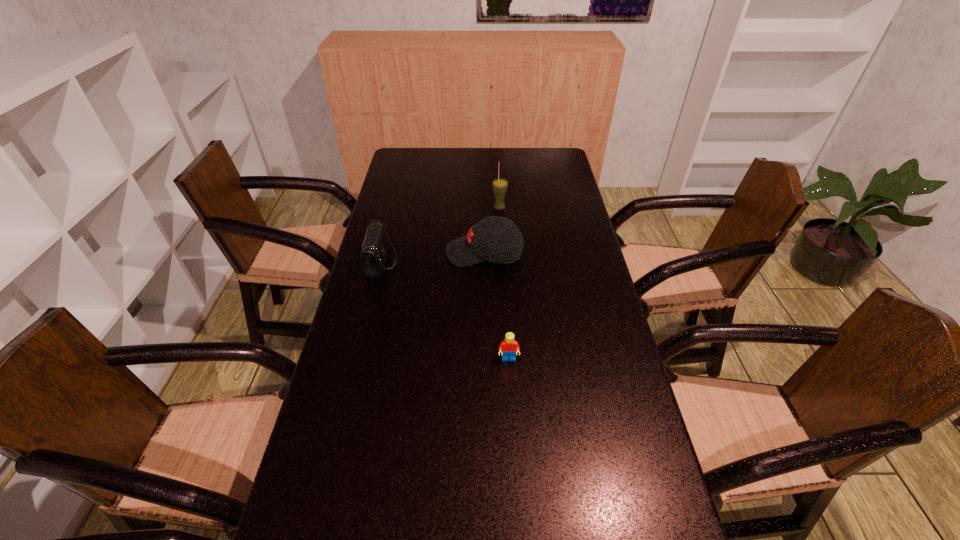
Where is `the tallest object`? The height and width of the screenshot is (540, 960). the tallest object is located at coordinates (499, 185).

Where is `the farthest object`? the farthest object is located at coordinates (499, 185).

Where is `the second tallest object`? the second tallest object is located at coordinates (481, 243).

Find the location of a particular element. This screenshot has height=540, width=960. clutch bag is located at coordinates (374, 247).

Find the location of `the nearest object`. the nearest object is located at coordinates (509, 346).

Find the location of a particular element. blank area located 0.360m on the back of the farthest object is located at coordinates (496, 157).

At what (x,y) coordinates should I click in order to perform the action: click on free spot located 0.200m on the front-facing side of the second tallest object. Please return your answer as a coordinate pair (x, y). This screenshot has height=540, width=960. Looking at the image, I should click on (386, 253).

At what (x,y) coordinates should I click in order to perform the action: click on vacant space situated on the front-facing side of the second tallest object. Please return your answer as a coordinate pair (x, y). Looking at the image, I should click on (379, 253).

I want to click on vacant space situated 0.160m on the front-facing side of the second tallest object, so click(x=397, y=253).

The image size is (960, 540). In order to click on free region located 0.280m on the front flap of the leftmost object in this screenshot , I will do `click(483, 261)`.